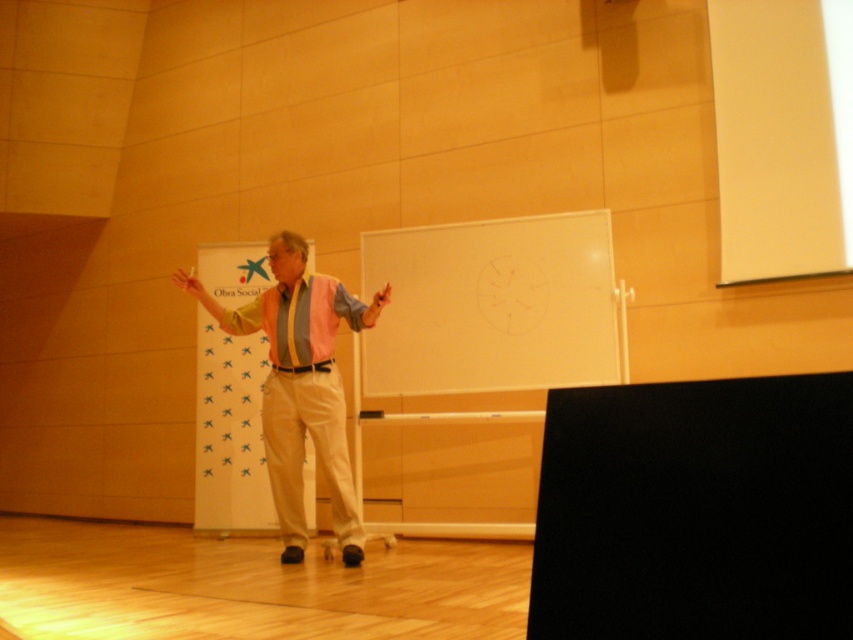
Question: Among these objects, which one is farthest from the camera?

Choices:
 (A) pink fabric dress shirt at center
 (B) white matte projection screen at upper right
 (C) pink fabric shirt at center
 (D) white matte board at center

Answer: (D)

Question: Does white matte board at center have a larger size compared to pink fabric shirt at center?

Choices:
 (A) no
 (B) yes

Answer: (A)

Question: Does pink fabric shirt at center come behind pink fabric dress shirt at center?

Choices:
 (A) no
 (B) yes

Answer: (A)

Question: Estimate the real-world distances between objects in this image. Which object is closer to the pink fabric dress shirt at center?

Choices:
 (A) white matte board at center
 (B) white matte projection screen at upper right

Answer: (A)

Question: Which object is the closest to the white matte board at center?

Choices:
 (A) pink fabric dress shirt at center
 (B) white matte projection screen at upper right

Answer: (A)

Question: Is white matte projection screen at upper right above pink fabric dress shirt at center?

Choices:
 (A) no
 (B) yes

Answer: (B)